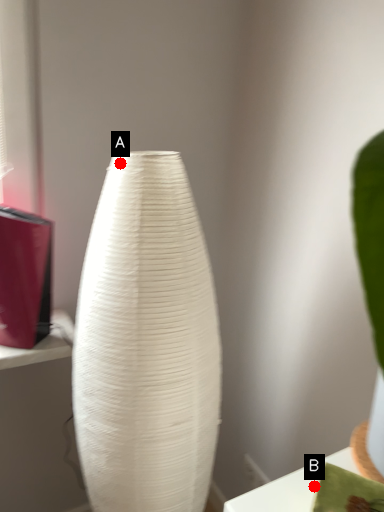
Question: Two points are circled on the image, labeled by A and B beside each circle. Among these points, which one is nearest to the camera?

Choices:
 (A) A is closer
 (B) B is closer

Answer: (B)